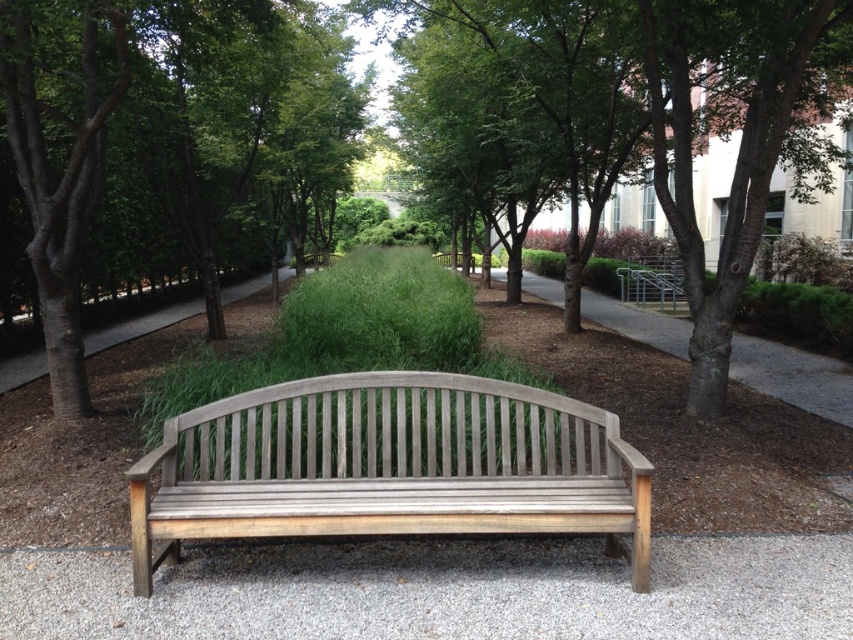
Identify the location of gray gravel at center. Image resolution: width=853 pixels, height=640 pixels. (440, 589).

Which of these two, gray gravel at center or brown wood tree at center, stands taller?

brown wood tree at center

Is point (312, 609) farther from camera compared to point (200, 228)?

No.

Find the location of a particular element. gray gravel at center is located at coordinates (440, 589).

How far apart are gray wood bench at center and brown gravel path at left?

6.86 meters

Can you confirm if gray wood bench at center is smaller than brown gravel path at left?

Yes, gray wood bench at center is smaller than brown gravel path at left.

Find the location of a particular element. This screenshot has width=853, height=640. gray wood bench at center is located at coordinates (390, 467).

Between point (648, 598) and point (183, 316), which one is positioned in front?

Point (648, 598)

Between gray gravel at center and brown gravel path at left, which one has more height?

Standing taller between the two is brown gravel path at left.

Measure the distance between point (239,589) and camera.

They are 3.52 meters apart.

In order to click on gray gravel at center in this screenshot , I will do [x=440, y=589].